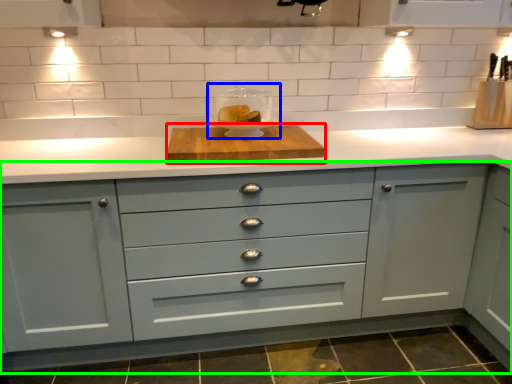
Question: Which is nearer to the cutting board (highlighted by a red box)? appliance (highlighted by a blue box) or cabinetry (highlighted by a green box).

Choices:
 (A) appliance
 (B) cabinetry

Answer: (A)